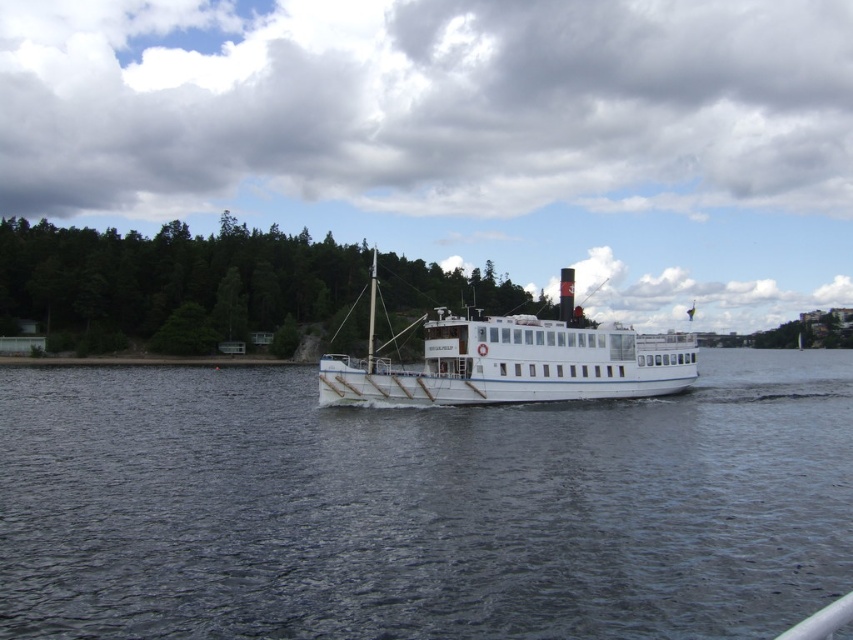
Can you confirm if dark blue water at center is shorter than green leafy trees at left?

Correct, dark blue water at center is not as tall as green leafy trees at left.

Is dark blue water at center to the right of green leafy trees at left from the viewer's perspective?

Correct, you'll find dark blue water at center to the right of green leafy trees at left.

The width and height of the screenshot is (853, 640). Describe the element at coordinates (422, 508) in the screenshot. I see `dark blue water at center` at that location.

At what (x,y) coordinates should I click in order to perform the action: click on dark blue water at center. Please return your answer as a coordinate pair (x, y). The image size is (853, 640). Looking at the image, I should click on (422, 508).

Is dark blue water at center below white matte boat at center?

Correct, dark blue water at center is located below white matte boat at center.

Can you confirm if dark blue water at center is positioned above white matte boat at center?

Actually, dark blue water at center is below white matte boat at center.

Describe the element at coordinates (422, 508) in the screenshot. I see `dark blue water at center` at that location.

The height and width of the screenshot is (640, 853). What are the coordinates of `dark blue water at center` in the screenshot? It's located at (422, 508).

Does green leafy trees at left have a greater height compared to white matte boat at center?

Correct, green leafy trees at left is much taller as white matte boat at center.

Does green leafy trees at left appear on the right side of white matte boat at center?

Incorrect, green leafy trees at left is not on the right side of white matte boat at center.

What do you see at coordinates (171, 282) in the screenshot? Image resolution: width=853 pixels, height=640 pixels. I see `green leafy trees at left` at bounding box center [171, 282].

At what (x,y) coordinates should I click in order to perform the action: click on green leafy trees at left. Please return your answer as a coordinate pair (x, y). Looking at the image, I should click on (171, 282).